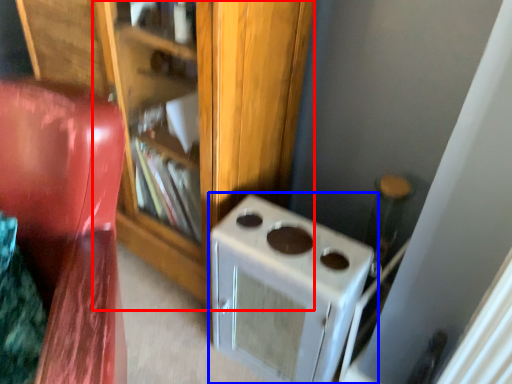
Question: Which object appears closest to the camera in this image, bookshelf (highlighted by a red box) or home appliance (highlighted by a blue box)?

Choices:
 (A) bookshelf
 (B) home appliance

Answer: (A)